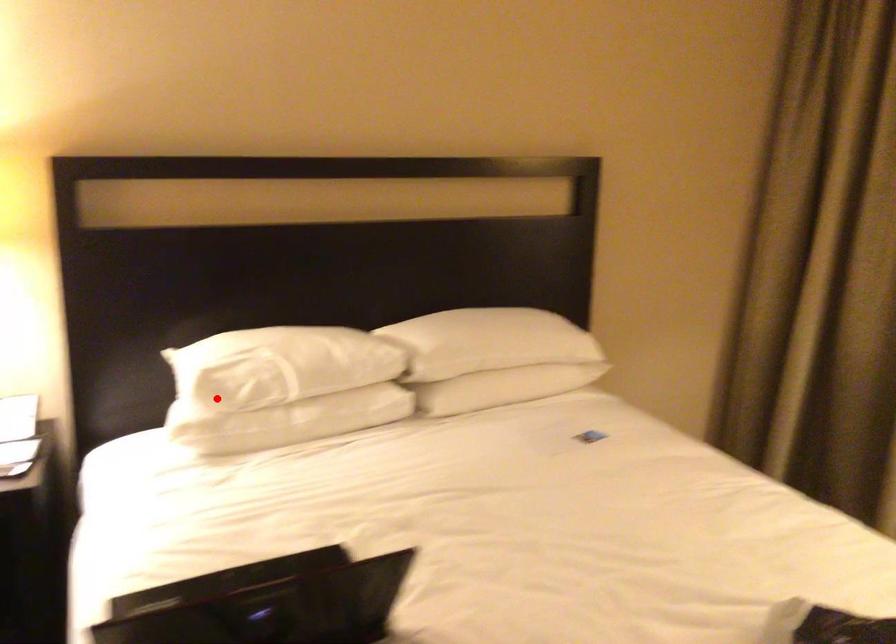
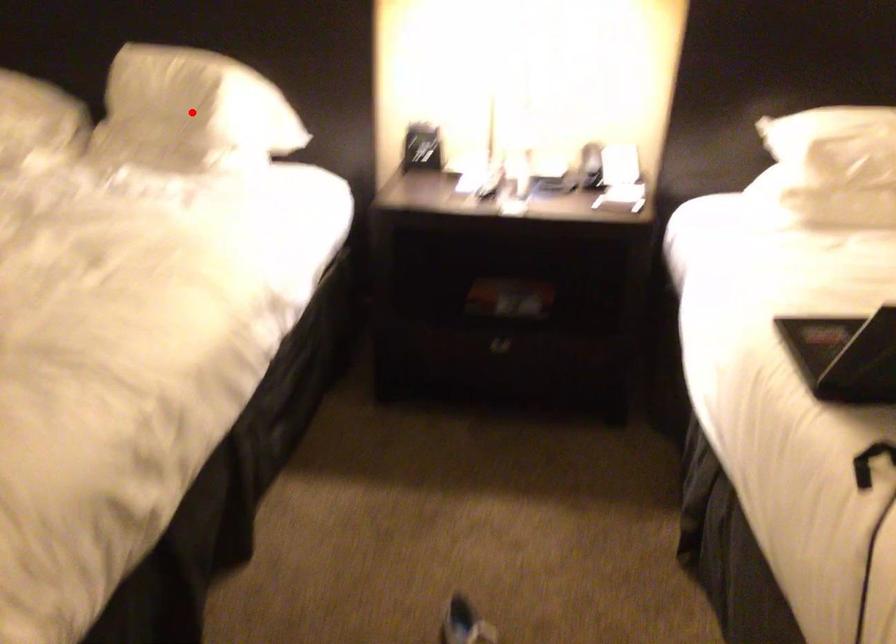
I am providing you with two images of the same scene from different viewpoints. A red point is marked on the first image and another point is marked on the second image. Are the points marked in image1 and image2 representing the same 3D position?

No